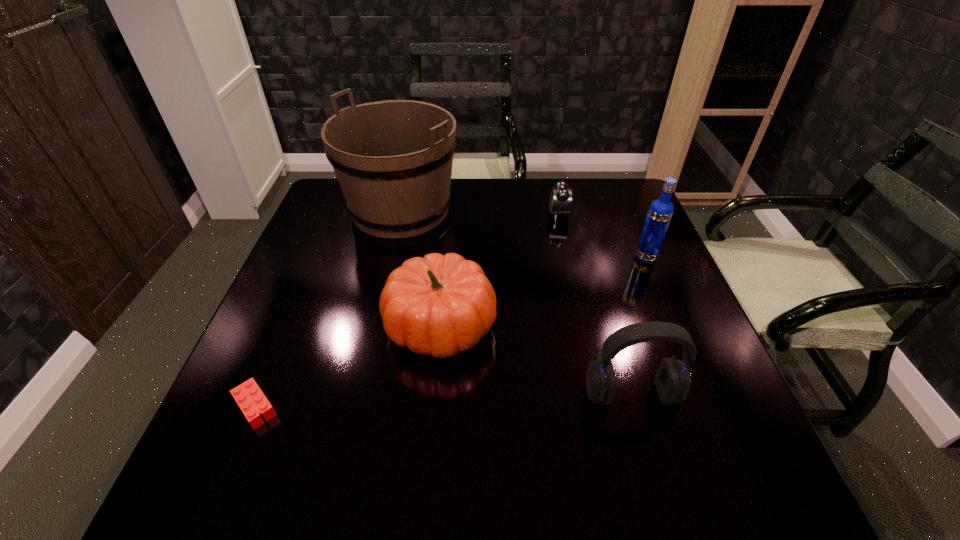
I want to click on vacant area that lies between the shortest object and the headset, so click(444, 400).

The height and width of the screenshot is (540, 960). In order to click on free space between the headset and the third nearest object in this screenshot , I will do `click(536, 360)`.

The image size is (960, 540). In order to click on object that is the third closest to the shortest object in this screenshot , I will do `click(672, 380)`.

Find the location of `the closest object to the headset`. the closest object to the headset is located at coordinates (440, 305).

The width and height of the screenshot is (960, 540). What are the coordinates of `free location that satisfies the following two spatial constraints: 1. on the back side of the fourth nearest object; 2. on the front side of the second shortest object` in the screenshot? It's located at (628, 214).

At what (x,y) coordinates should I click in order to perform the action: click on free spot that satisfies the following two spatial constraints: 1. on the front side of the alarm clock; 2. on the back side of the second tallest object. Please return your answer as a coordinate pair (x, y). The height and width of the screenshot is (540, 960). Looking at the image, I should click on (568, 257).

The image size is (960, 540). Find the location of `vacant space that satisfies the following two spatial constraints: 1. on the front side of the alarm clock; 2. on the left side of the fourth nearest object`. vacant space that satisfies the following two spatial constraints: 1. on the front side of the alarm clock; 2. on the left side of the fourth nearest object is located at coordinates (568, 257).